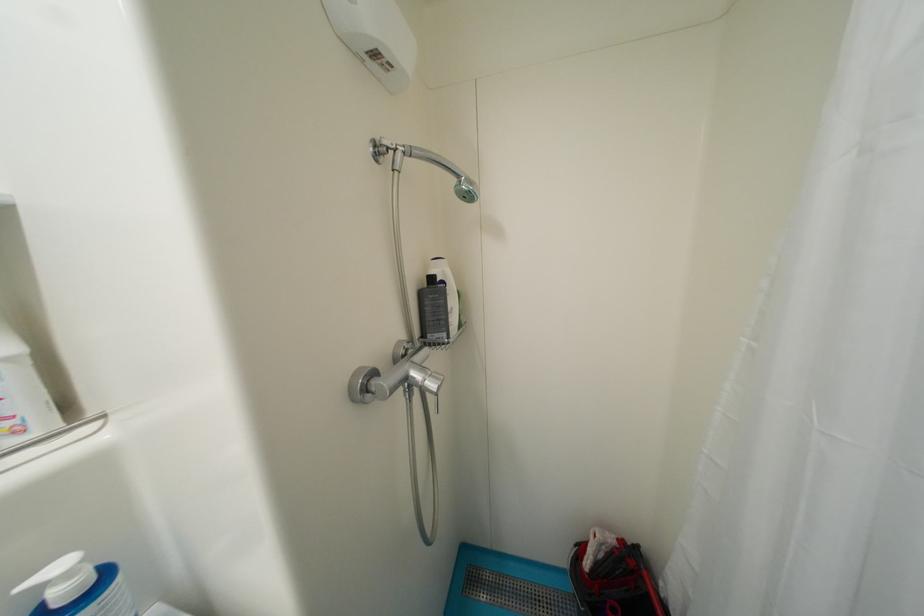
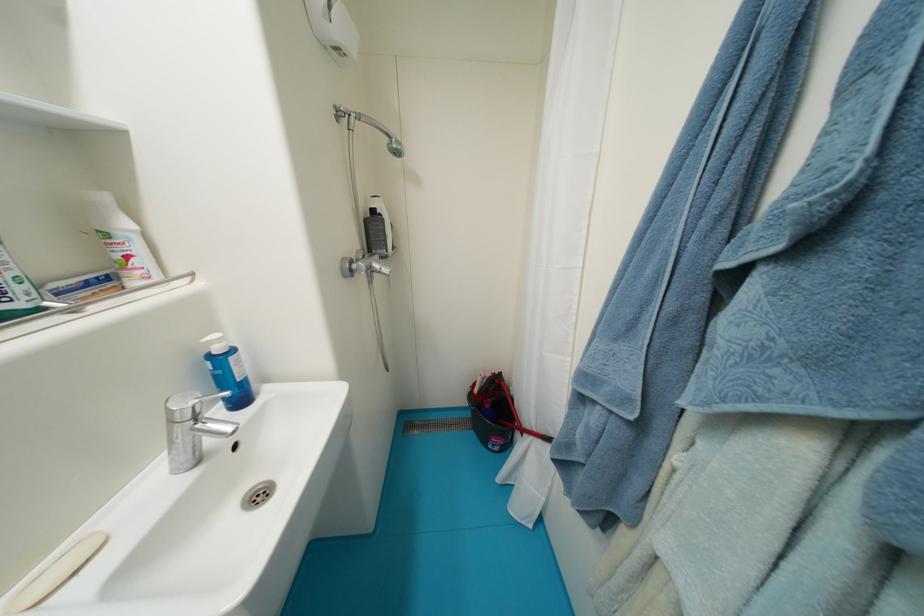
Find the pixel in the second image that matches point (618, 541) in the first image.

(495, 377)